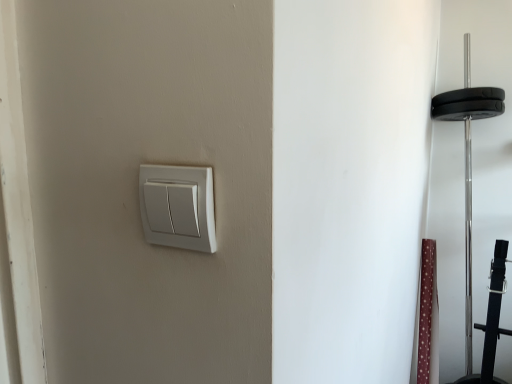
Question: Should I look upward or downward to see maroon fabric curtain at right?

Choices:
 (A) down
 (B) up

Answer: (A)